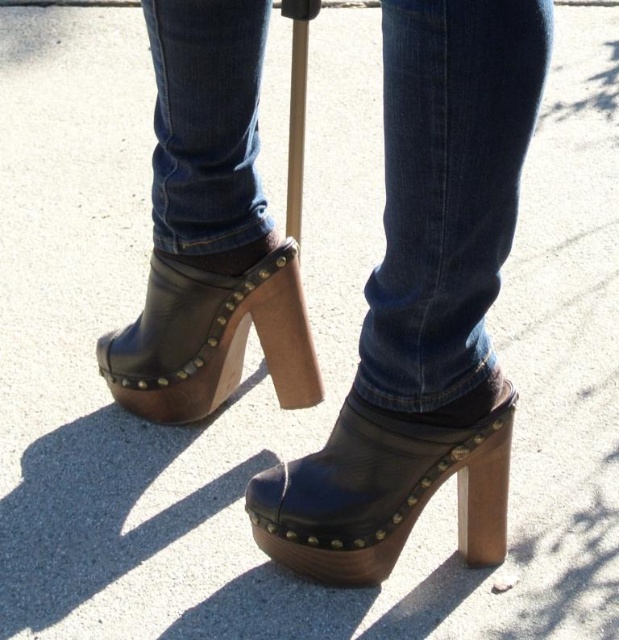
You are a photographer trying to capture both the black leather clog at center and the leather studded clog at center in a single frame. Since you want to highlight both equally, which clog should be positioned on the left side of the frame to ensure both are visible?

The leather studded clog at center should be positioned on the left side of the frame because the black leather clog at center is to the right of it, allowing both to be captured equally in the frame.

You are a photographer holding a camera at eye level. You want to take a clear photo of the black leather clog at center. What is the minimum distance you should maintain between the camera and the clog to ensure the photo is in focus?

The black leather clog at center and camera are 1.22 meters apart, so you should maintain at least 1.22 meters distance to ensure the photo is in focus.

You are a photographer trying to capture a detailed shot of the black leather clog at center. However, the denim at center is blocking part of the clog. Based on the scene, can you adjust your position to get a clearer view of the clog without moving the subject?

The denim at center is closer to the viewer than the black leather clog at center. To get a clearer view of the clog, you should move your camera position slightly lower to angle under the denim, allowing the clog to come into focus while minimizing the obstruction from the denim.